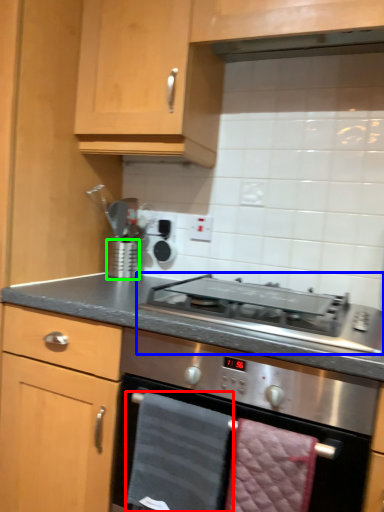
Question: Which is nearer to the hand towel (highlighted by a red box)? gas stove (highlighted by a blue box) or kitchen appliance (highlighted by a green box).

Choices:
 (A) gas stove
 (B) kitchen appliance

Answer: (A)